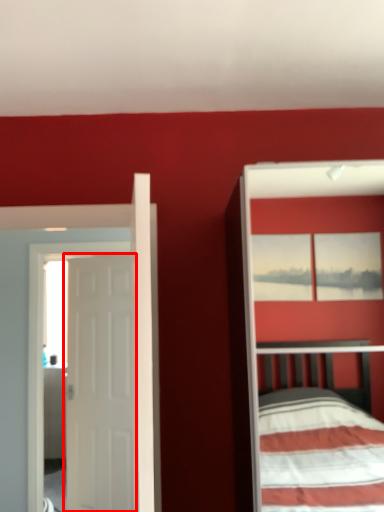
Question: From the image's perspective, what is the correct spatial positioning of door (annotated by the red box) in reference to door?

Choices:
 (A) above
 (B) below

Answer: (B)